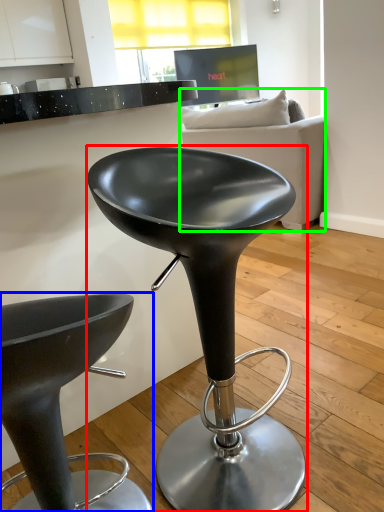
Question: Which object is the farthest from stool (highlighted by a red box)? Choose among these: stool (highlighted by a blue box) or studio couch (highlighted by a green box).

Choices:
 (A) stool
 (B) studio couch

Answer: (B)